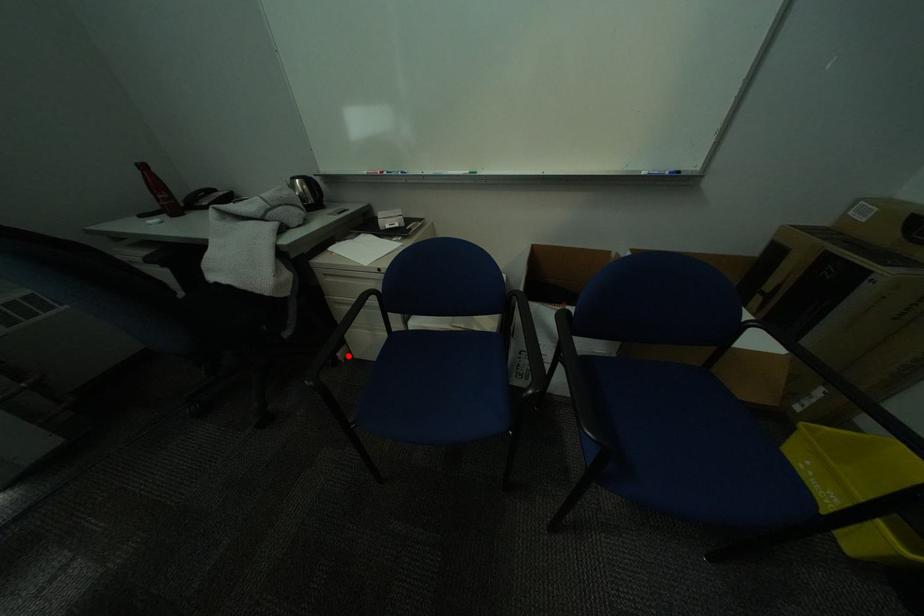
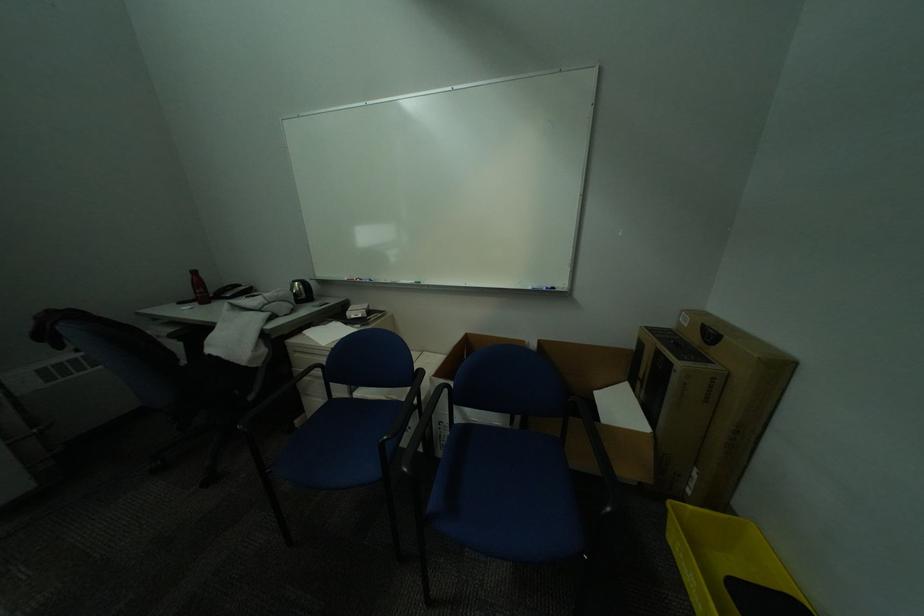
The point at the highlighted location is marked in the first image. Where is the corresponding point in the second image?

(306, 423)